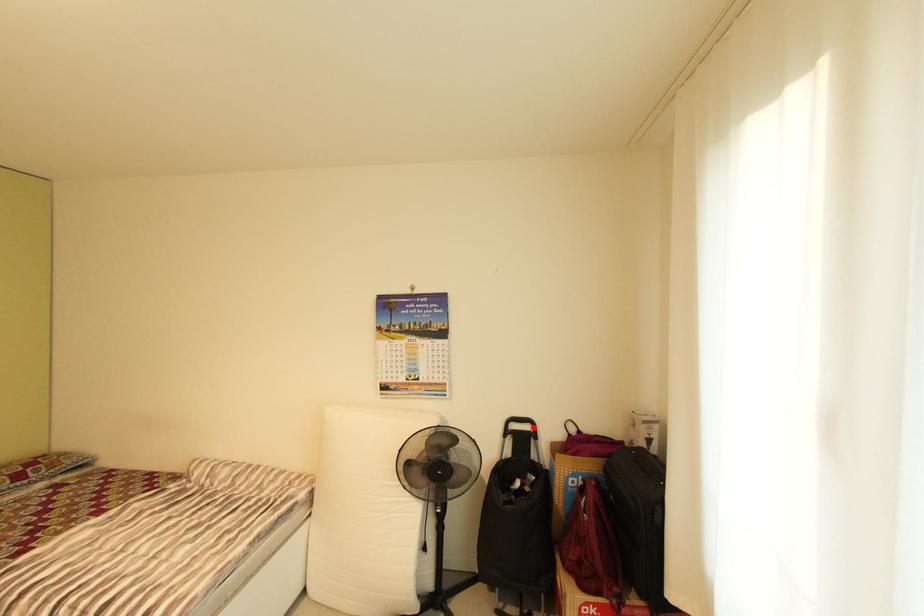
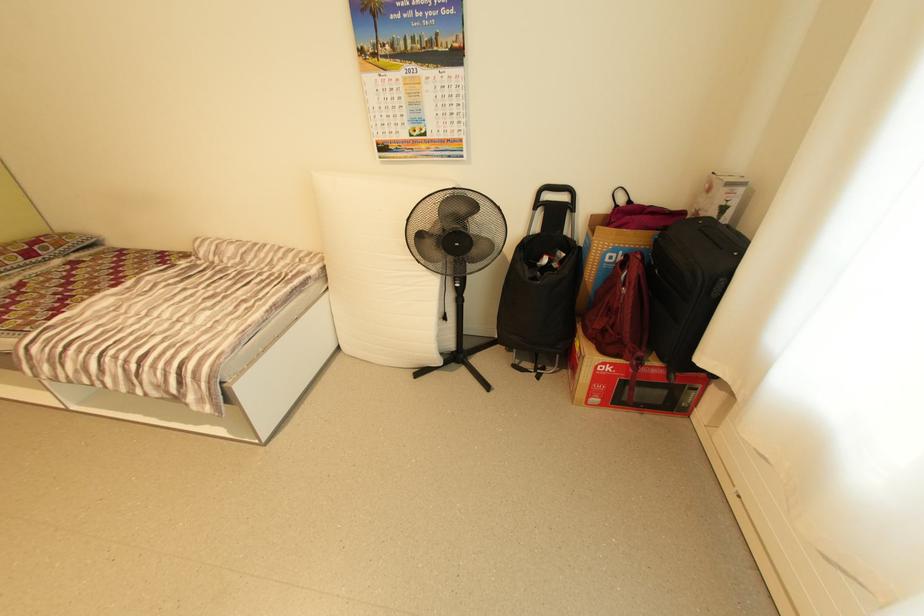
Question: I am providing you with two images of the same scene from different viewpoints. In image1, a red point is highlighted. Considering the same 3D point in image2, which of the following is correct?

Choices:
 (A) It is closer
 (B) It is farther

Answer: (A)